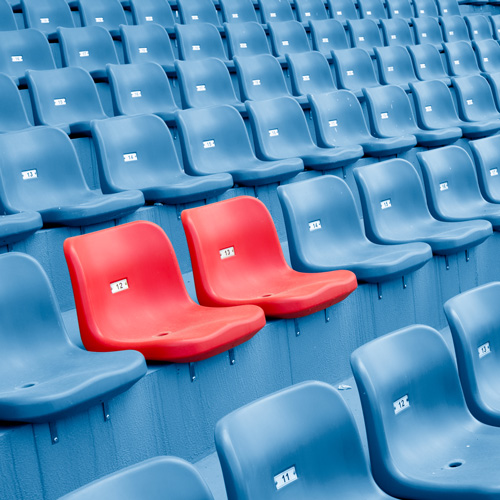
What are the coordinates of `blue seats in the same row as the red seats` in the screenshot? It's located at (54, 368), (345, 257), (430, 223), (462, 205), (492, 180).